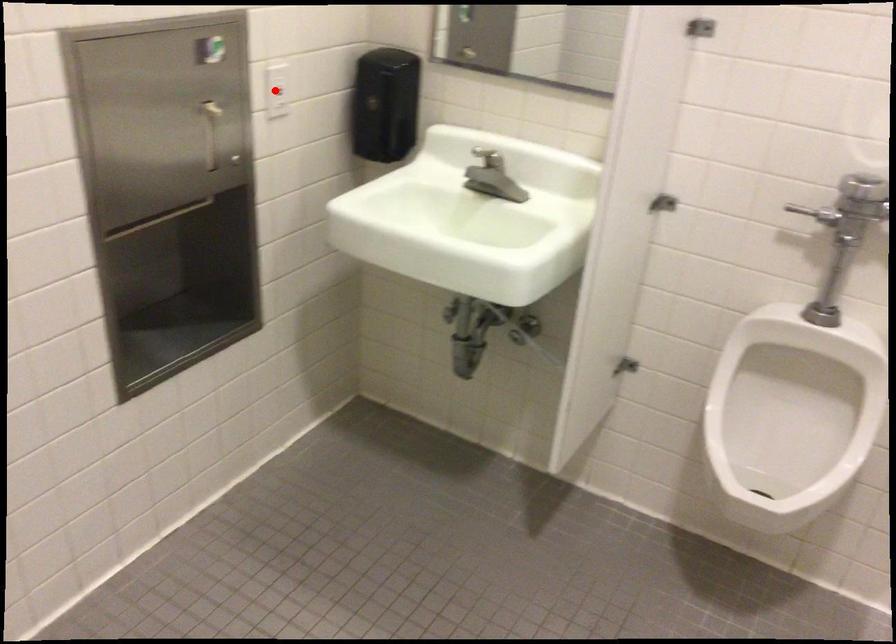
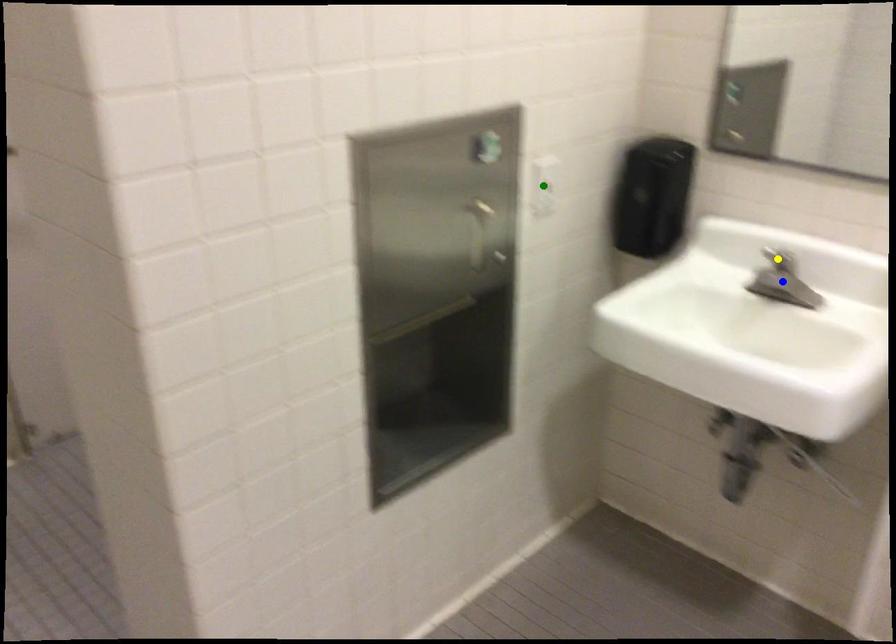
Question: I am providing you with two images of the same scene from different viewpoints. A red point is marked on the first image. You are given multiple points on the second image. Which spot in image 2 lines up with the point in image 1?

Choices:
 (A) yellow point
 (B) blue point
 (C) green point

Answer: (C)